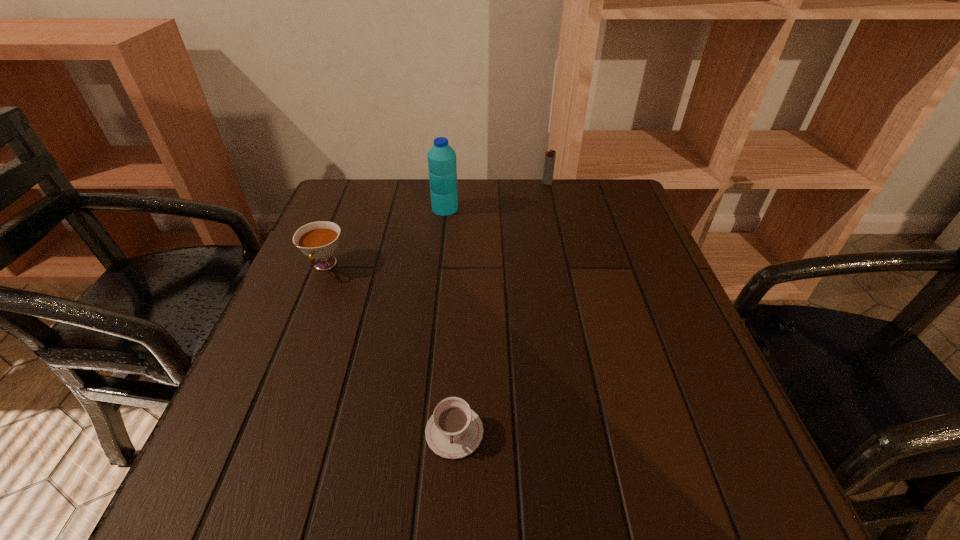
In order to click on the third nearest object in this screenshot , I will do `click(442, 166)`.

Locate an element on the screen. This screenshot has width=960, height=540. water bottle is located at coordinates (442, 166).

You are a GUI agent. You are given a task and a screenshot of the screen. Output one action in this format:
    pyautogui.click(x=<x>, y=<y>)
    Task: Click on the second tallest object
    The height and width of the screenshot is (540, 960).
    Given the screenshot: What is the action you would take?
    pyautogui.click(x=549, y=162)

This screenshot has height=540, width=960. In order to click on the rightmost object in this screenshot , I will do `click(549, 162)`.

The width and height of the screenshot is (960, 540). I want to click on the left teacup, so click(x=319, y=240).

This screenshot has width=960, height=540. I want to click on the second shortest object, so click(319, 240).

This screenshot has height=540, width=960. Identify the location of the shorter teacup. (454, 431).

The width and height of the screenshot is (960, 540). What are the coordinates of `the nearest object` in the screenshot? It's located at pyautogui.click(x=454, y=431).

Identify the location of free space located on the left of the water bottle. (355, 208).

This screenshot has height=540, width=960. What are the coordinates of `vacant space located 0.130m on the front of the igniter` in the screenshot? It's located at (553, 211).